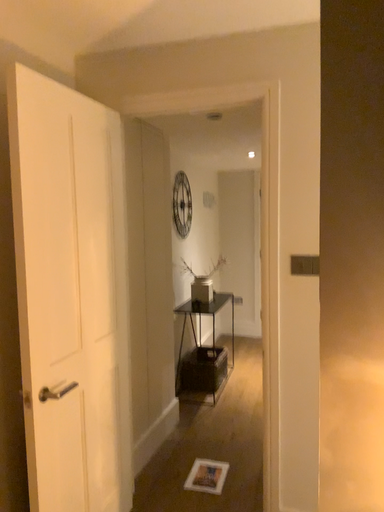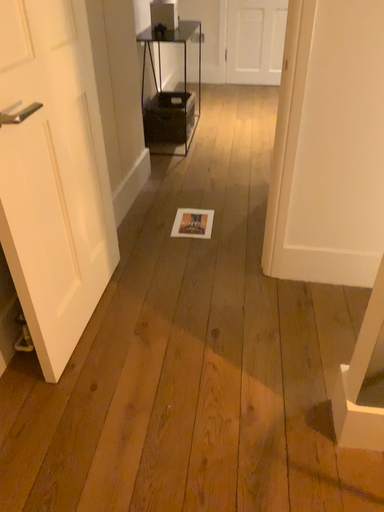
Question: Which way did the camera rotate in the video?

Choices:
 (A) rotated right
 (B) rotated left

Answer: (A)